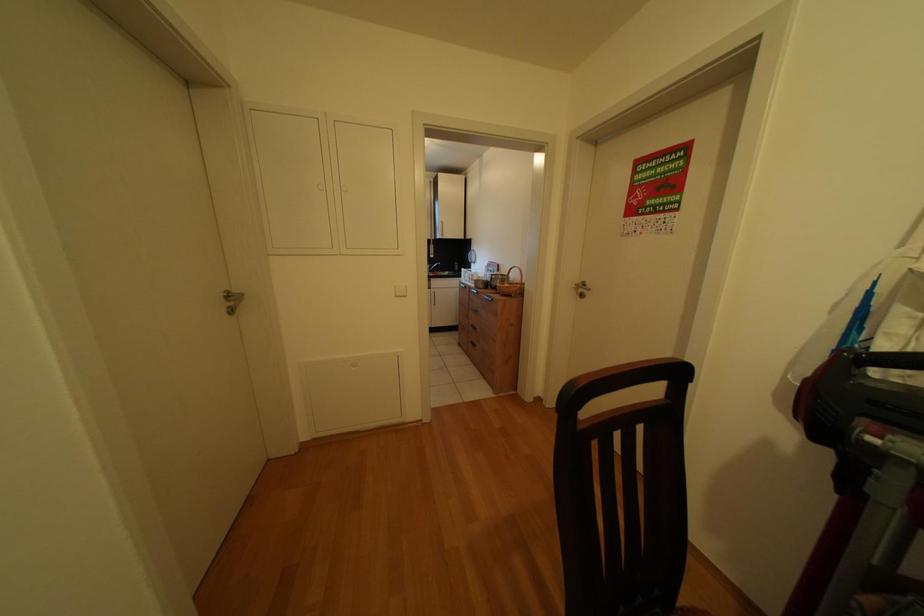
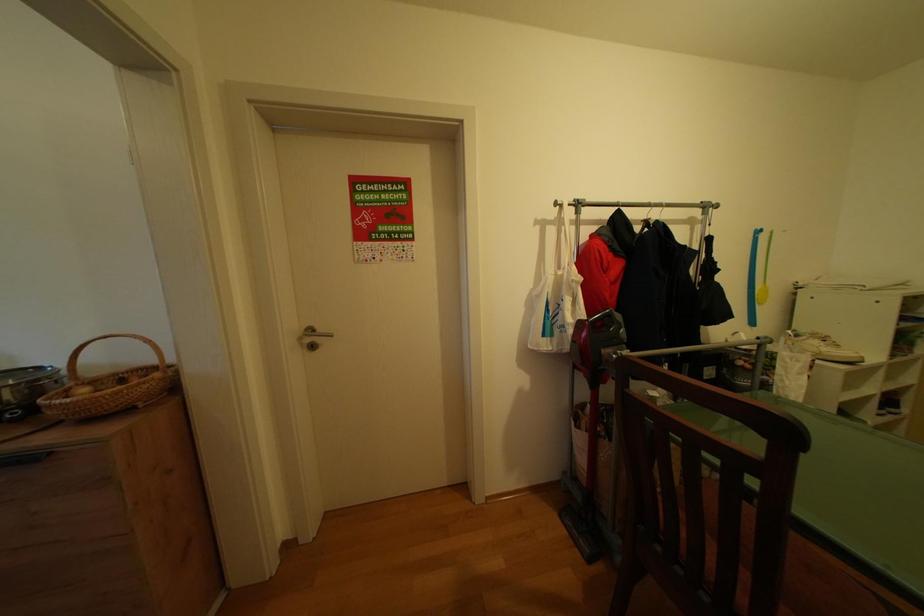
Question: The camera is either moving clockwise (left) or counter-clockwise (right) around the object. The first image is from the beginning of the video and the second image is from the end. Is the camera moving left or right when shooting the video?

Choices:
 (A) Left
 (B) Right

Answer: (A)